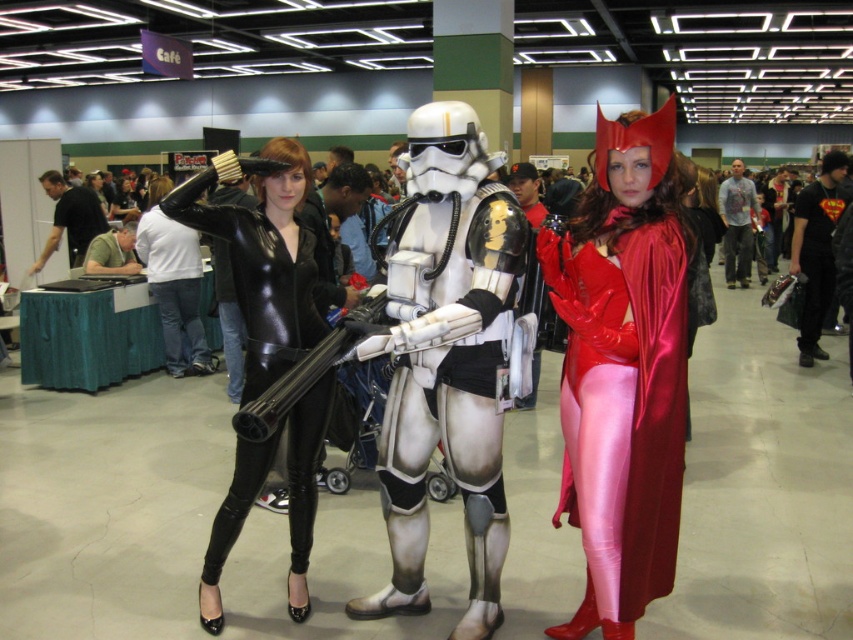
Question: Which of the following is the farthest from the observer?

Choices:
 (A) (231, 244)
 (B) (602, 280)
 (C) (421, 572)

Answer: (C)

Question: Among these objects, which one is nearest to the camera?

Choices:
 (A) white metallic armor at center
 (B) shiny red cape at center
 (C) black shiny suit at center

Answer: (B)

Question: Is shiny red cape at center wider than white metallic armor at center?

Choices:
 (A) yes
 (B) no

Answer: (B)

Question: Does white metallic armor at center have a smaller size compared to black shiny suit at center?

Choices:
 (A) yes
 (B) no

Answer: (B)

Question: Can you confirm if white metallic armor at center is positioned above black shiny suit at center?

Choices:
 (A) yes
 (B) no

Answer: (B)

Question: Which of the following is the farthest from the observer?

Choices:
 (A) (622, 627)
 (B) (247, 477)
 (C) (405, 509)

Answer: (B)